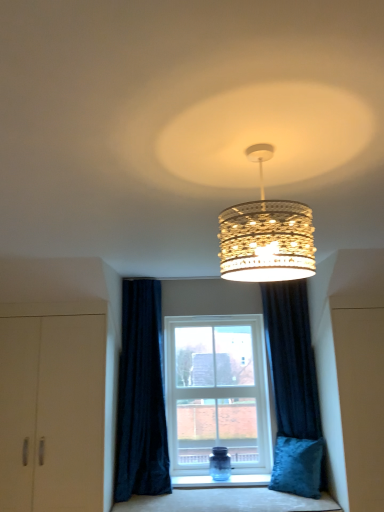
Image resolution: width=384 pixels, height=512 pixels. Describe the element at coordinates (292, 359) in the screenshot. I see `velvet dark blue curtain at lower right, the first curtain in the right-to-left sequence` at that location.

In order to face dark blue velvet curtain at lower center, the first curtain positioned from the left, should I rotate leftwards or rightwards?

It's best to rotate left around 5.820 degrees.

How much space does dark blue velvet curtain at lower center, the first curtain positioned from the left, occupy horizontally?

The width of dark blue velvet curtain at lower center, the first curtain positioned from the left, is 12.93 inches.

What is the approximate height of velvet blue pillow at lower right?

19.23 inches.

Measure the distance between point (265, 468) and camera.

Point (265, 468) and camera are 3.56 meters apart.

You are a GUI agent. You are given a task and a screenshot of the screen. Output one action in this format:
    pyautogui.click(x=<x>, y=<y>)
    Task: Click on the velvet dark blue curtain at lower right, the first curtain in the right-to-left sequence
    The image size is (384, 512).
    Given the screenshot: What is the action you would take?
    pyautogui.click(x=292, y=359)

From the image's perspective, is white plastic window at center located beneath velvet blue pillow at lower right?

Actually, white plastic window at center appears above velvet blue pillow at lower right in the image.

Is white plastic window at center turned away from velvet blue pillow at lower right?

white plastic window at center does not have its back to velvet blue pillow at lower right.

Which object is closer to the camera, white plastic window at center or velvet blue pillow at lower right?

velvet blue pillow at lower right is in front.

Which is closer, (256, 362) or (283, 415)?

Point (256, 362) is positioned farther from the camera compared to point (283, 415).

From the image's perspective, is white plastic window at center located above velvet dark blue curtain at lower right, which ranks as the 2th curtain in left-to-right order?

No.

Is white plastic window at center in front of or behind velvet dark blue curtain at lower right, which ranks as the 2th curtain in left-to-right order, in the image?

Visually, white plastic window at center is located behind velvet dark blue curtain at lower right, which ranks as the 2th curtain in left-to-right order.

Which of these two, white plastic window at center or velvet dark blue curtain at lower right, which ranks as the 2th curtain in left-to-right order, is smaller?

velvet dark blue curtain at lower right, which ranks as the 2th curtain in left-to-right order, is smaller.

Based on the photo, is matte beige cabinet at left positioned before white plastic window at center?

Yes.

Based on the photo, is matte beige cabinet at left positioned with its back to white plastic window at center?

That's not correct — matte beige cabinet at left is not looking away from white plastic window at center.

Choose the correct answer: Is matte beige cabinet at left inside white plastic window at center or outside it?

matte beige cabinet at left exists outside the volume of white plastic window at center.

How different are the orientations of velvet blue cushion at lower center and gold textured chandelier at center in degrees?

86.3 degrees.

Which is behind, point (130, 499) or point (272, 277)?

The point (130, 499) is farther.

Would you say velvet blue cushion at lower center is to the left or to the right of gold textured chandelier at center in the picture?

In the image, velvet blue cushion at lower center appears on the right side of gold textured chandelier at center.

Who is taller, velvet blue cushion at lower center or gold textured chandelier at center?

With more height is gold textured chandelier at center.

Are dark blue velvet curtain at lower center, which is the second curtain from right to left, and velvet blue cushion at lower center located far from each other?

They are positioned close to each other.

Which of these two, dark blue velvet curtain at lower center, the first curtain positioned from the left, or velvet blue cushion at lower center, is smaller?

velvet blue cushion at lower center.

Is dark blue velvet curtain at lower center, the first curtain positioned from the left, facing away from velvet blue cushion at lower center?

No, dark blue velvet curtain at lower center, the first curtain positioned from the left, is not facing the opposite direction of velvet blue cushion at lower center.

Consider the image. From the image's perspective, is dark blue velvet curtain at lower center, the first curtain positioned from the left, below velvet blue cushion at lower center?

Actually, dark blue velvet curtain at lower center, the first curtain positioned from the left, appears above velvet blue cushion at lower center in the image.

In the scene shown: Is velvet dark blue curtain at lower right, which ranks as the 2th curtain in left-to-right order, wider or thinner than matte beige cabinet at left?

velvet dark blue curtain at lower right, which ranks as the 2th curtain in left-to-right order, is wider than matte beige cabinet at left.

From a real-world perspective, is velvet dark blue curtain at lower right, the first curtain in the right-to-left sequence, below matte beige cabinet at left?

Incorrect, from a real-world perspective, velvet dark blue curtain at lower right, the first curtain in the right-to-left sequence, is higher than matte beige cabinet at left.

Between velvet dark blue curtain at lower right, which ranks as the 2th curtain in left-to-right order, and matte beige cabinet at left, which one has more height?

Standing taller between the two is velvet dark blue curtain at lower right, which ranks as the 2th curtain in left-to-right order.

Is velvet dark blue curtain at lower right, the first curtain in the right-to-left sequence, facing away from matte beige cabinet at left?

velvet dark blue curtain at lower right, the first curtain in the right-to-left sequence, is not turned away from matte beige cabinet at left.

Considering the positions of point (8, 493) and point (229, 279), is point (8, 493) closer or farther from the camera than point (229, 279)?

Clearly, point (8, 493) is more distant from the camera than point (229, 279).

From the image's perspective, is matte beige cabinet at left below gold textured chandelier at center?

Indeed, from the image's perspective, matte beige cabinet at left is shown beneath gold textured chandelier at center.

Are matte beige cabinet at left and gold textured chandelier at center located far from each other?

Indeed, matte beige cabinet at left is not near gold textured chandelier at center.

Does matte beige cabinet at left come behind gold textured chandelier at center?

Yes, it is.

Locate an element on the screen. Image resolution: width=384 pixels, height=512 pixels. pillow lying on the right of white plastic window at center is located at coordinates (297, 466).

Identify the location of window below the velvet dark blue curtain at lower right, the first curtain in the right-to-left sequence (from the image's perspective). The image size is (384, 512). (x=217, y=393).

Looking at the image, which one is located closer to white plastic window at center, velvet blue pillow at lower right or gold textured chandelier at center?

velvet blue pillow at lower right.

From the picture: Estimate the real-world distances between objects in this image. Which object is closer to matte beige cabinet at left, velvet blue cushion at lower center or gold textured chandelier at center?

velvet blue cushion at lower center.

Considering their positions, is velvet blue pillow at lower right positioned further to velvet blue cushion at lower center than matte beige cabinet at left?

The object further to velvet blue cushion at lower center is matte beige cabinet at left.

Which object lies further to the anchor point gold textured chandelier at center, dark blue velvet curtain at lower center, the first curtain positioned from the left, or velvet dark blue curtain at lower right, which ranks as the 2th curtain in left-to-right order?

Based on the image, dark blue velvet curtain at lower center, the first curtain positioned from the left, appears to be further to gold textured chandelier at center.

Based on their spatial positions, is gold textured chandelier at center or dark blue velvet curtain at lower center, the first curtain positioned from the left, closer to velvet blue cushion at lower center?

dark blue velvet curtain at lower center, the first curtain positioned from the left, is closer to velvet blue cushion at lower center.

Looking at this image, from the image, which object appears to be farther from white plastic window at center, velvet dark blue curtain at lower right, which ranks as the 2th curtain in left-to-right order, or gold textured chandelier at center?

Among the two, gold textured chandelier at center is located further to white plastic window at center.

Which object lies nearer to the anchor point velvet blue pillow at lower right, velvet blue cushion at lower center or matte beige cabinet at left?

Among the two, velvet blue cushion at lower center is located nearer to velvet blue pillow at lower right.

Looking at the image, which one is located further to dark blue velvet curtain at lower center, which is the second curtain from right to left, velvet dark blue curtain at lower right, the first curtain in the right-to-left sequence, or velvet blue cushion at lower center?

Among the two, velvet dark blue curtain at lower right, the first curtain in the right-to-left sequence, is located further to dark blue velvet curtain at lower center, which is the second curtain from right to left.

Where is `dresser between gold textured chandelier at center and velvet blue cushion at lower center in the vertical direction`? Image resolution: width=384 pixels, height=512 pixels. dresser between gold textured chandelier at center and velvet blue cushion at lower center in the vertical direction is located at coordinates (52, 412).

Find the location of a particular element. The image size is (384, 512). bedding between matte beige cabinet at left and velvet blue pillow at lower right from left to right is located at coordinates (227, 501).

Where is `window between matte beige cabinet at left and velvet blue pillow at lower right from left to right`? window between matte beige cabinet at left and velvet blue pillow at lower right from left to right is located at coordinates [x=217, y=393].

Find the location of a particular element. dresser located between gold textured chandelier at center and white plastic window at center in the depth direction is located at coordinates (52, 412).